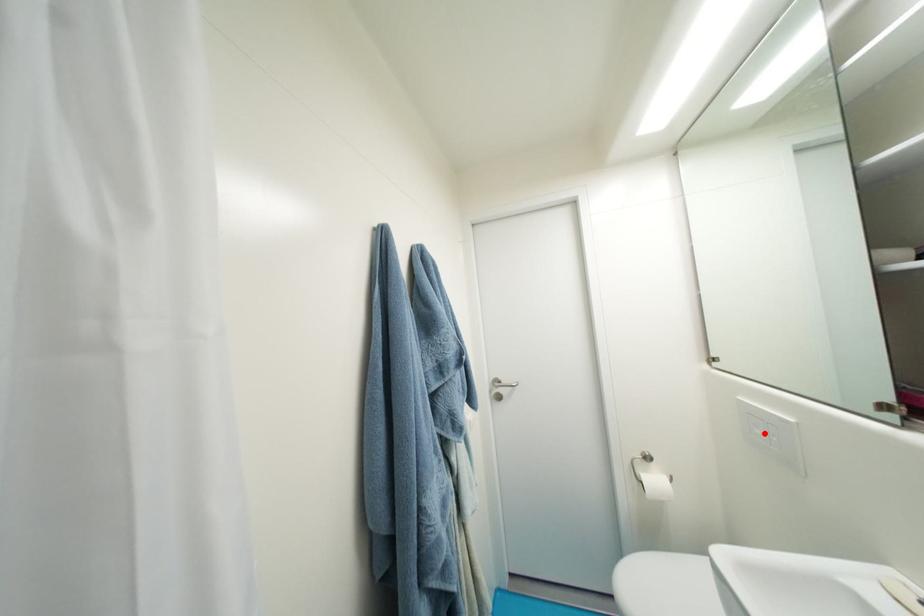
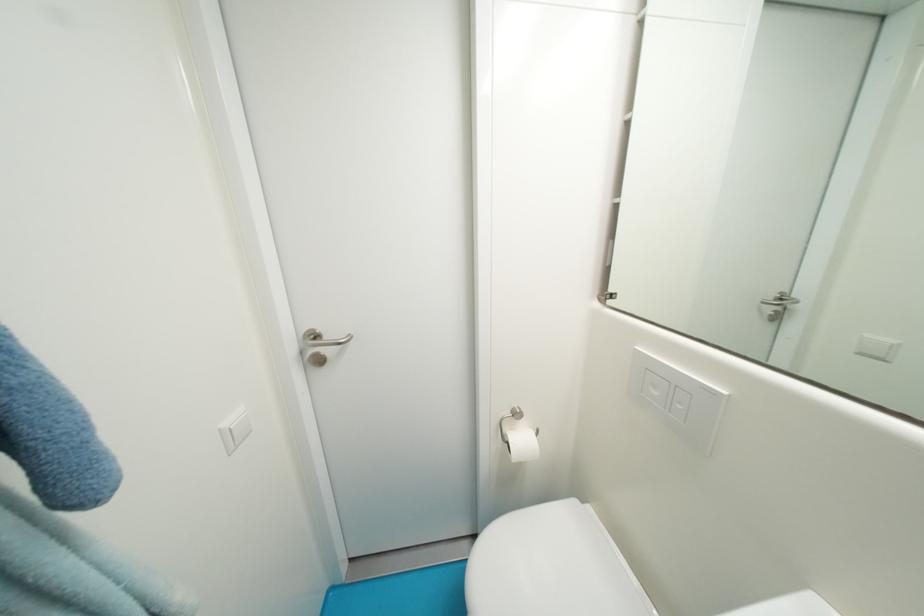
Locate, in the second image, the point that corresponds to the highlighted location in the first image.

(662, 395)